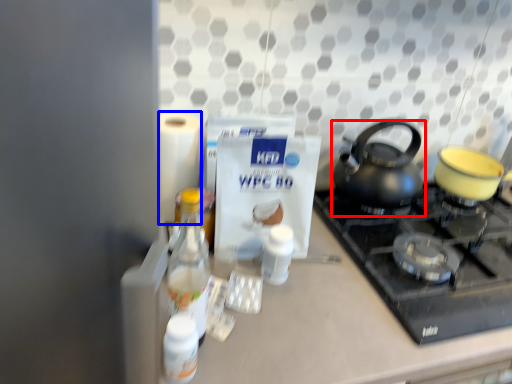
Question: Which object is further to the camera taking this photo, kettle (highlighted by a red box) or toilet paper (highlighted by a blue box)?

Choices:
 (A) kettle
 (B) toilet paper

Answer: (A)